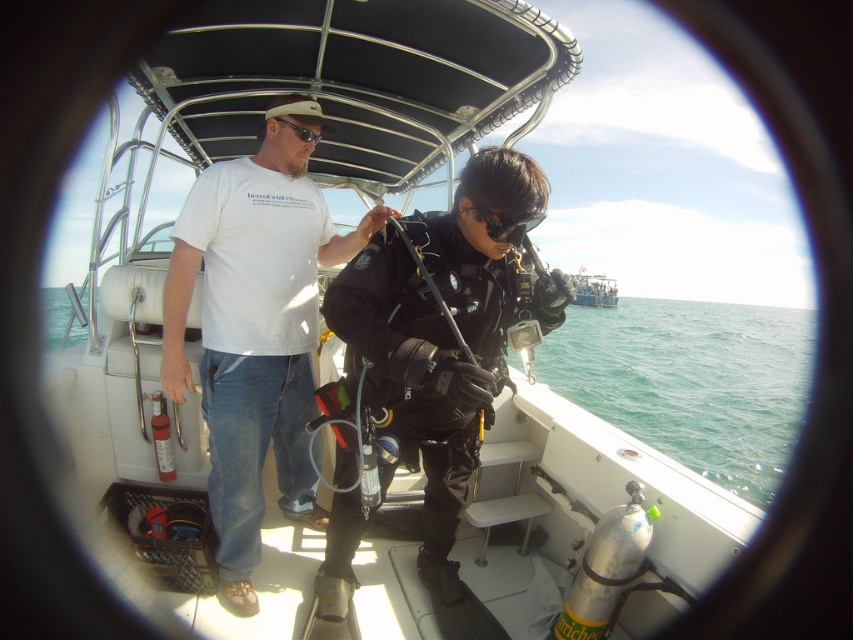
You are on a boat preparing for a dive and see both the black matte diving suit at center and the black rubber wetsuit at center. Which one is located below the other?

The black matte diving suit at center is positioned under the black rubber wetsuit at center.

You are on a diving boat and need to put on your gear. You see the black rubber wetsuit at center and the black matte goggles at center. Which item is located to the right when facing the center of the boat?

The black rubber wetsuit at center is to the right of the black matte goggles at center, so the black rubber wetsuit at center is located to the right when facing the center of the boat.